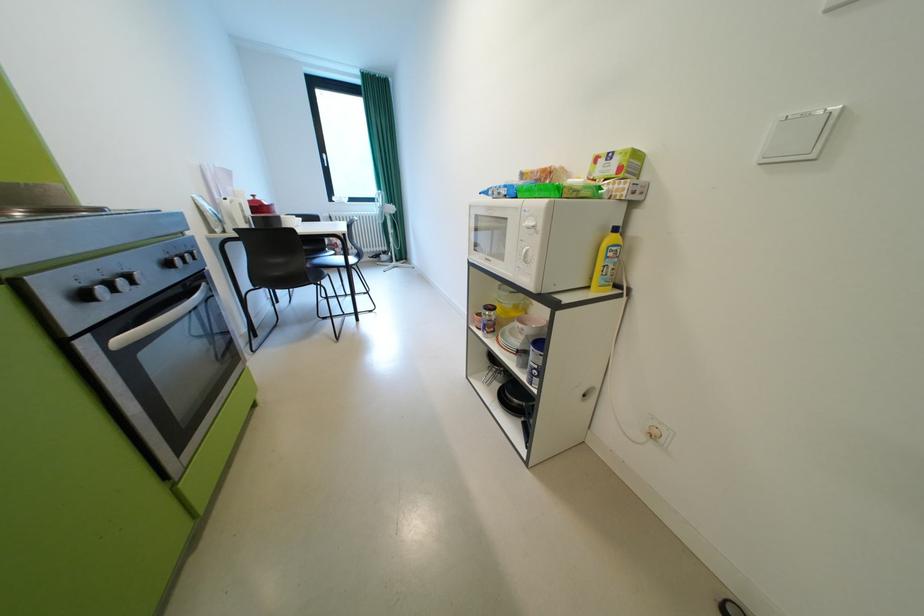
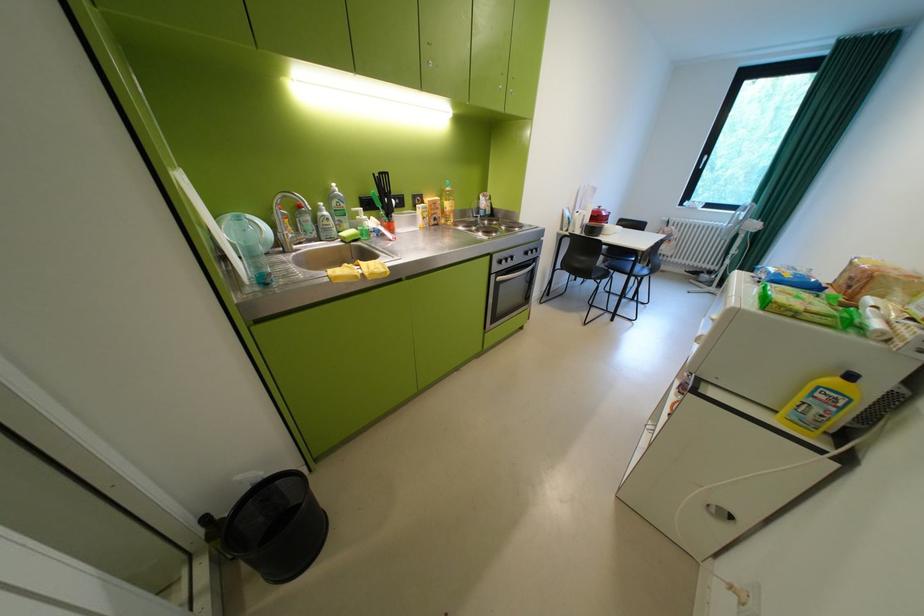
In the second image, find the point that corresponds to point (287, 275) in the first image.

(587, 265)